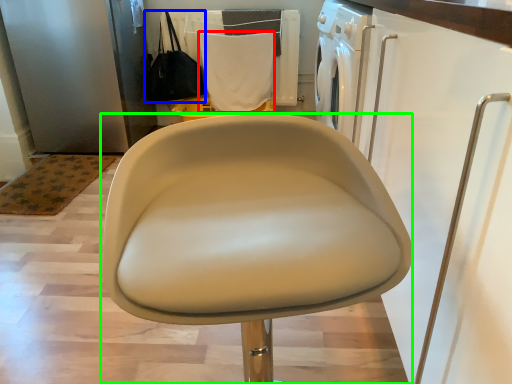
Question: Which is nearer to the cloth (highlighted by a red box)? handbag (highlighted by a blue box) or chair (highlighted by a green box).

Choices:
 (A) handbag
 (B) chair

Answer: (A)